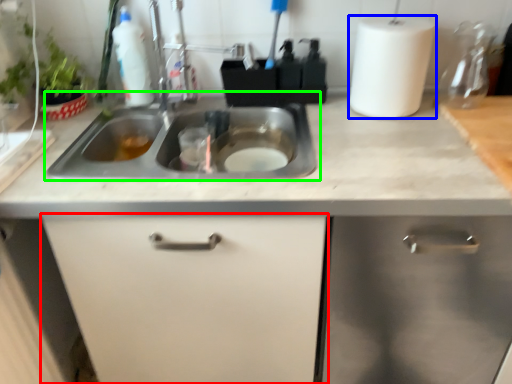
Question: Which object is the farthest from cabinetry (highlighted by a red box)? Choose among these: paper towel (highlighted by a blue box) or sink (highlighted by a green box).

Choices:
 (A) paper towel
 (B) sink

Answer: (A)